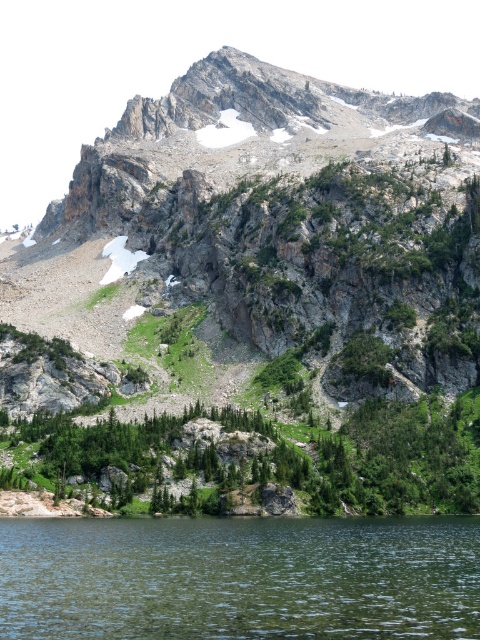
Question: Among these points, which one is nearest to the camera?

Choices:
 (A) (x=227, y=228)
 (B) (x=180, y=625)

Answer: (B)

Question: Which of the following is the farthest from the observer?

Choices:
 (A) (301, 525)
 (B) (301, 387)

Answer: (B)

Question: Is rocky gray mountain at upper center bigger than clear water at lower center?

Choices:
 (A) yes
 (B) no

Answer: (A)

Question: Which point is closer to the camera taking this photo?

Choices:
 (A) (93, 289)
 (B) (369, 634)

Answer: (B)

Question: Does rocky gray mountain at upper center have a lesser width compared to clear water at lower center?

Choices:
 (A) yes
 (B) no

Answer: (B)

Question: Does rocky gray mountain at upper center appear over clear water at lower center?

Choices:
 (A) yes
 (B) no

Answer: (A)